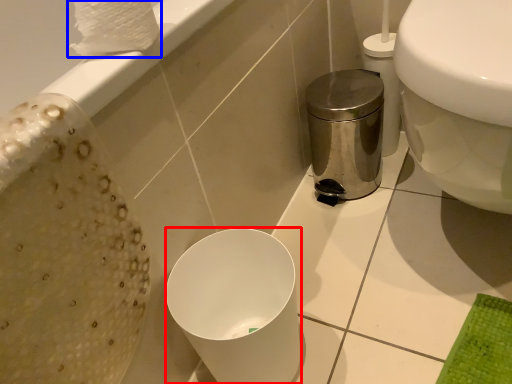
Question: Which object is closer to the camera taking this photo, bidet (highlighted by a red box) or toilet paper (highlighted by a blue box)?

Choices:
 (A) bidet
 (B) toilet paper

Answer: (B)